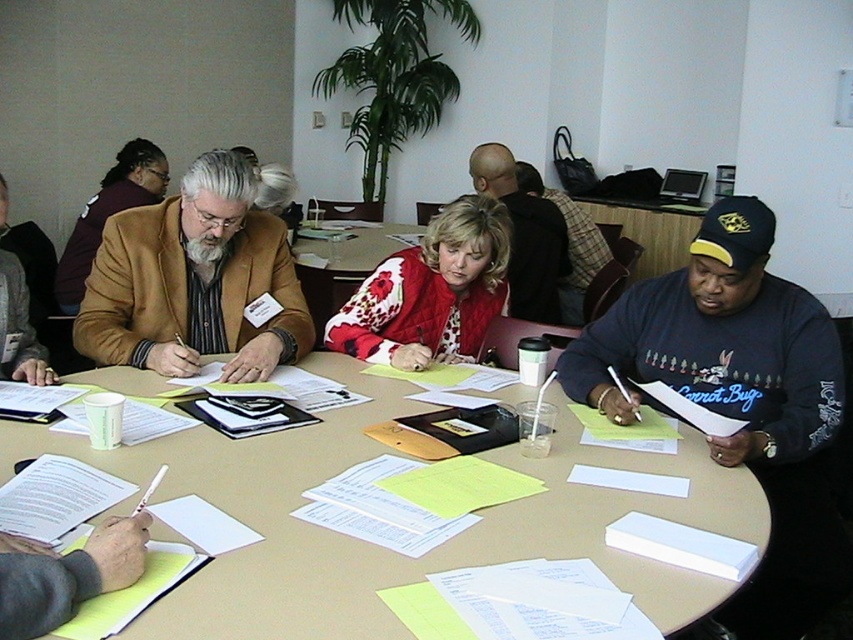
You are standing at the entrance of the conference room and see the point marked at coordinates (721, 342). What object is located at that point?

The point at coordinates (721, 342) corresponds to the dark blue sweatshirt at lower right.

You are a participant in the meeting and need to pass a document to the person wearing the red floral sweater at center. The document is on the light brown wooden table at center. Can you reach it without moving from your seat?

The light brown wooden table at center and red floral sweater at center are 20.65 inches apart from each other. Since the average human arm length is about 25 inches, you can likely reach the document on the light brown wooden table at center from the red floral sweater at center without moving from your seat.